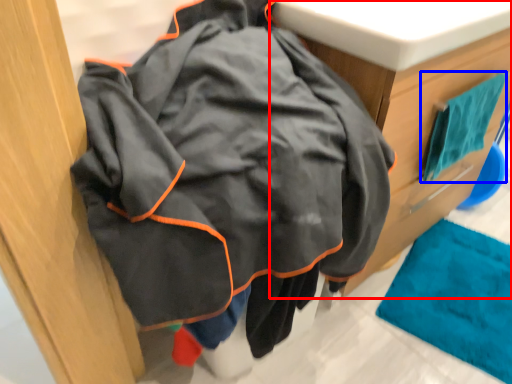
Question: Among these objects, which one is nearest to the camera, furniture (highlighted by a red box) or bath towel (highlighted by a blue box)?

Choices:
 (A) furniture
 (B) bath towel

Answer: (A)